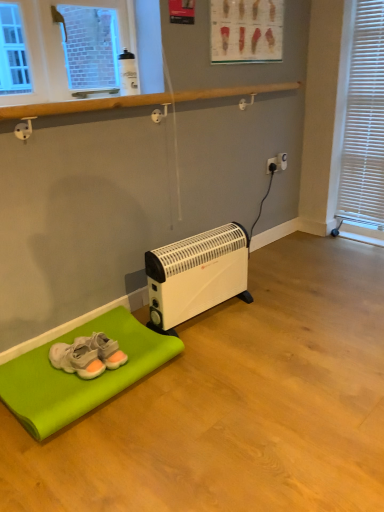
Question: From a real-world perspective, is white plastic blinds at right physically below white plastic heater at lower center?

Choices:
 (A) yes
 (B) no

Answer: (B)

Question: Is white plastic blinds at right not within white plastic heater at lower center?

Choices:
 (A) yes
 (B) no

Answer: (A)

Question: Would you say white plastic blinds at right contains white plastic heater at lower center?

Choices:
 (A) no
 (B) yes

Answer: (A)

Question: Does white plastic blinds at right turn towards white plastic heater at lower center?

Choices:
 (A) yes
 (B) no

Answer: (A)

Question: Is white plastic blinds at right at the right side of white plastic heater at lower center?

Choices:
 (A) yes
 (B) no

Answer: (A)

Question: Is there a large distance between white plastic blinds at right and white plastic heater at lower center?

Choices:
 (A) no
 (B) yes

Answer: (B)

Question: Is white plastic electric outlet at center-right, placed as the second electric outlet when sorted from left to right, further to the viewer compared to gray suede sneakers at lower left?

Choices:
 (A) no
 (B) yes

Answer: (B)

Question: Can you confirm if white plastic electric outlet at center-right, which is the 1th electric outlet from right to left, is bigger than gray suede sneakers at lower left?

Choices:
 (A) yes
 (B) no

Answer: (B)

Question: From a real-world perspective, is white plastic electric outlet at center-right, placed as the second electric outlet when sorted from left to right, positioned under gray suede sneakers at lower left based on gravity?

Choices:
 (A) yes
 (B) no

Answer: (B)

Question: Is white plastic electric outlet at center-right, which is the 1th electric outlet from right to left, located outside gray suede sneakers at lower left?

Choices:
 (A) no
 (B) yes

Answer: (B)

Question: From the image's perspective, is white plastic electric outlet at center-right, which is the 1th electric outlet from right to left, above gray suede sneakers at lower left?

Choices:
 (A) yes
 (B) no

Answer: (A)

Question: Does white plastic electric outlet at center-right, placed as the second electric outlet when sorted from left to right, have a greater width compared to gray suede sneakers at lower left?

Choices:
 (A) no
 (B) yes

Answer: (A)

Question: Can you see white plastic electric outlet at center-right, which is the 1th electric outlet from right to left, touching white plastic heater at lower center?

Choices:
 (A) yes
 (B) no

Answer: (B)